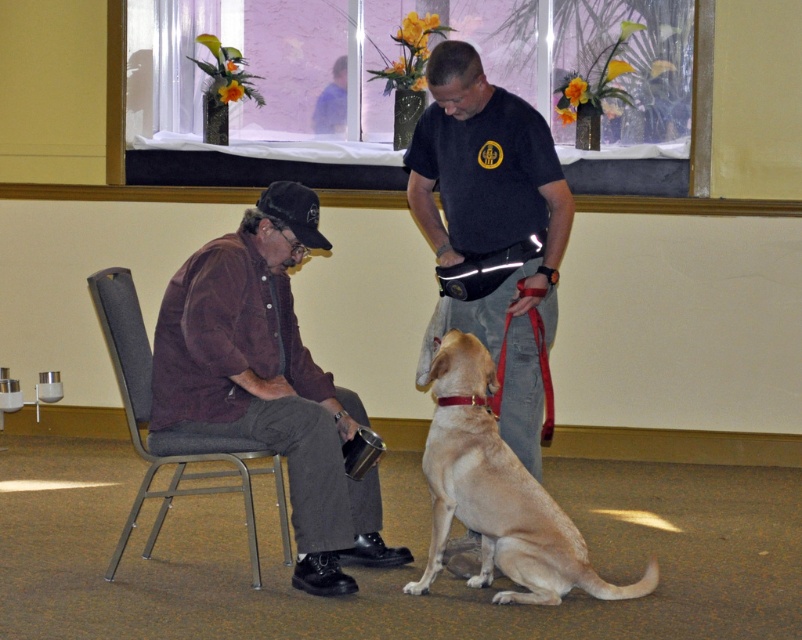
You are organizing a small event and need to know if the brown suede shirt at left can be placed on the gray fabric chair at left without falling off. Based on their sizes, what would you advise?

The brown suede shirt at left might be wider than the gray fabric chair at left, so there is a risk of it falling off if placed there. It is advisable to choose a wider or more stable surface for the shirt.

You are organizing a charity event and need to determine which item takes up more space in your storage. You have a brown suede shirt at left and a gray fabric chair at left. Which item requires more storage space?

The brown suede shirt at left has a larger size compared to the gray fabric chair at left, so it requires more storage space.